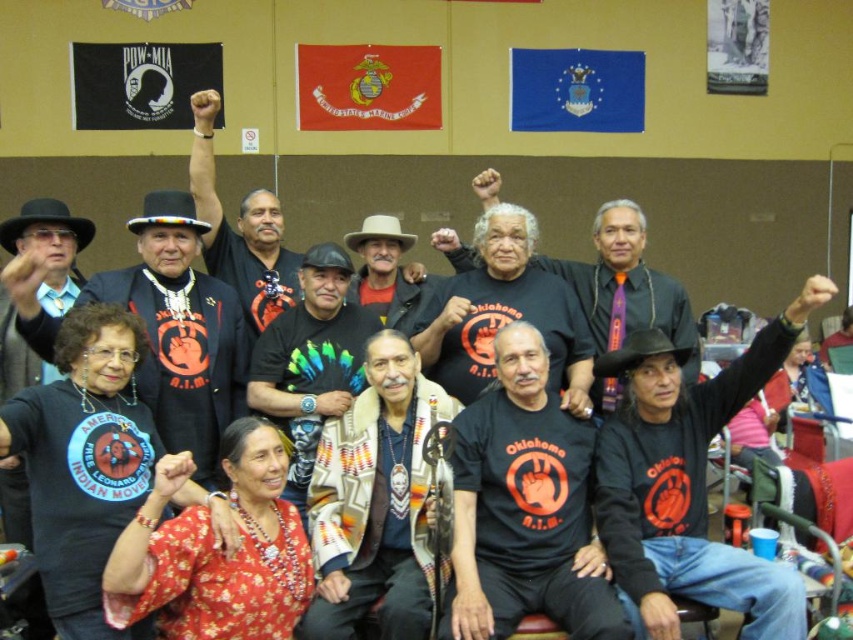
Question: Is black cotton shirt at center to the right of matte black t-shirt at center from the viewer's perspective?

Choices:
 (A) yes
 (B) no

Answer: (A)

Question: Which is nearer to the black t-shirt with orange graphic at center?

Choices:
 (A) matte black shirt at center
 (B) woven fabric shawl at center
 (C) black cotton t-shirt at center

Answer: (C)

Question: Which point is closer to the camera?

Choices:
 (A) (216, 214)
 (B) (635, 321)
 (C) (485, 408)

Answer: (C)

Question: Which object is closer to the camera taking this photo?

Choices:
 (A) black cotton t-shirt at center
 (B) matte black t-shirt at center
 (C) matte black shirt at center

Answer: (A)

Question: Is matte black t-shirt at center thinner than black leather shirt at center?

Choices:
 (A) yes
 (B) no

Answer: (B)

Question: Is black cotton shirt at center wider than black leather shirt at center?

Choices:
 (A) yes
 (B) no

Answer: (A)